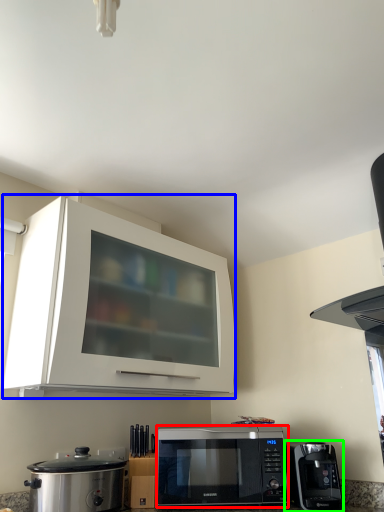
Question: Based on their relative distances, which object is nearer to microwave oven (highlighted by a red box)? Choose from cabinetry (highlighted by a blue box) and coffee maker (highlighted by a green box).

Choices:
 (A) cabinetry
 (B) coffee maker

Answer: (B)